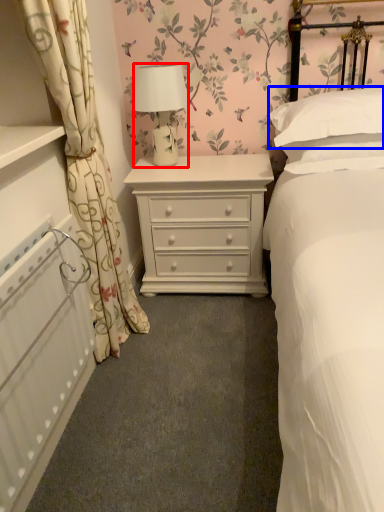
Question: Which point is further to the camera, lamp (highlighted by a red box) or pillow (highlighted by a blue box)?

Choices:
 (A) lamp
 (B) pillow

Answer: (A)